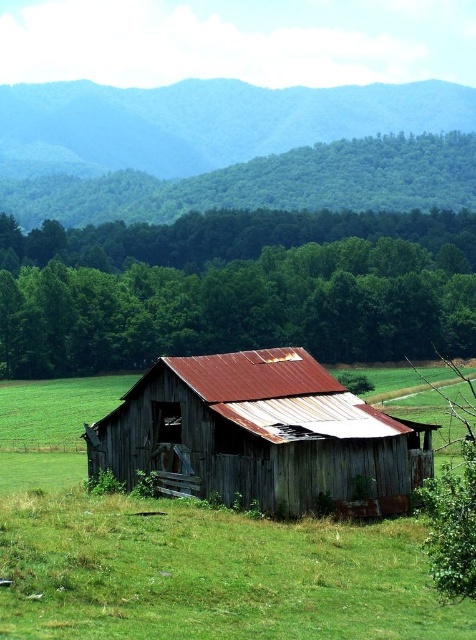
Does rusty metal barn at center have a larger size compared to green forested hillside at upper left?

No, rusty metal barn at center is not bigger than green forested hillside at upper left.

Is rusty metal barn at center wider than green forested hillside at upper left?

No, rusty metal barn at center is not wider than green forested hillside at upper left.

Between point (207, 358) and point (257, 97), which one is positioned behind?

The point (257, 97) is more distant.

This screenshot has height=640, width=476. Find the location of `rusty metal barn at center`. rusty metal barn at center is located at coordinates (260, 435).